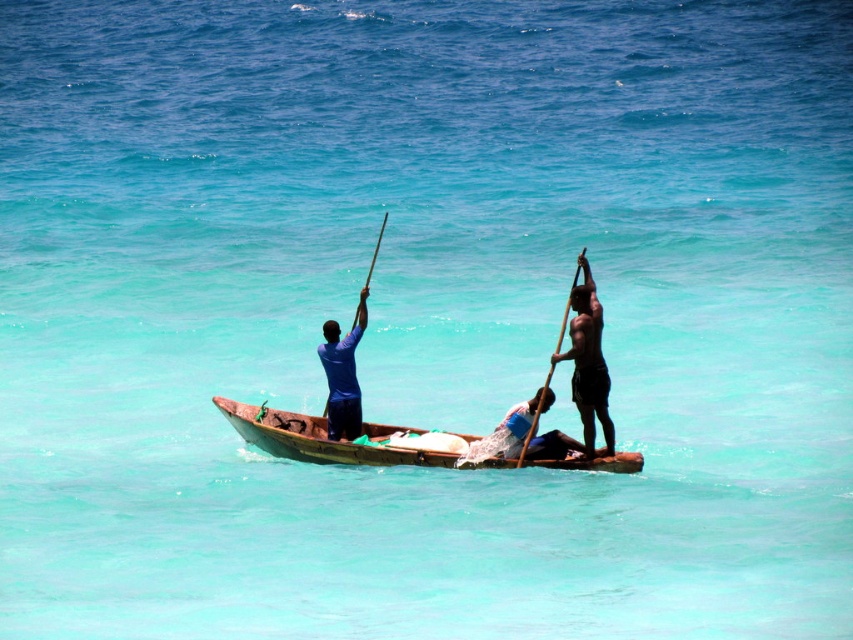
Is point (341, 381) closer to camera compared to point (355, 317)?

Yes, point (341, 381) is in front of point (355, 317).

Does blue fabric shirt at center have a smaller size compared to wooden pole at center?

Yes, blue fabric shirt at center is smaller than wooden pole at center.

The image size is (853, 640). Identify the location of blue fabric shirt at center. (341, 374).

Who is positioned more to the left, blue fabric shirt at center or wooden pole at right?

blue fabric shirt at center

Consider the image. Does blue fabric shirt at center have a greater height compared to wooden pole at right?

No.

Between point (355, 410) and point (550, 372), which one is positioned behind?

The point (355, 410) is behind.

Locate an element on the screen. This screenshot has width=853, height=640. blue fabric shirt at center is located at coordinates (341, 374).

Image resolution: width=853 pixels, height=640 pixels. What do you see at coordinates (589, 362) in the screenshot? I see `shiny black pole at right` at bounding box center [589, 362].

Does shiny black pole at right have a lesser width compared to wooden pole at center?

Indeed, shiny black pole at right has a lesser width compared to wooden pole at center.

You are a GUI agent. You are given a task and a screenshot of the screen. Output one action in this format:
    pyautogui.click(x=<x>, y=<y>)
    Task: Click on the shiny black pole at right
    The width and height of the screenshot is (853, 640).
    Given the screenshot: What is the action you would take?
    pyautogui.click(x=589, y=362)